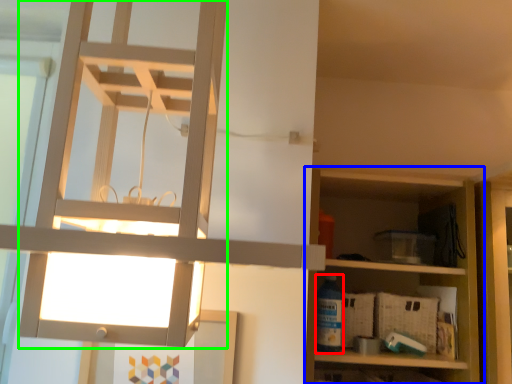
Question: Considering the real-world distances, which object is closest to bottle (highlighted by a red box)? shelf (highlighted by a blue box) or lamp (highlighted by a green box).

Choices:
 (A) shelf
 (B) lamp

Answer: (A)